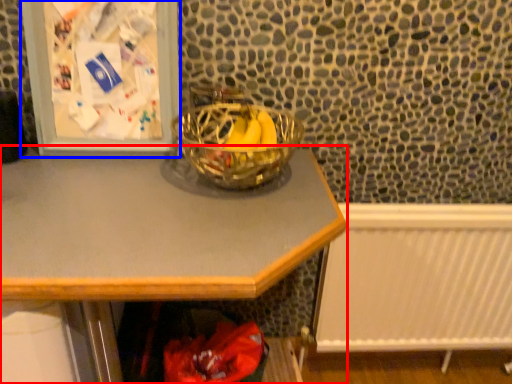
Question: Which point is further to the camera, desk (highlighted by a red box) or picture frame (highlighted by a blue box)?

Choices:
 (A) desk
 (B) picture frame

Answer: (B)